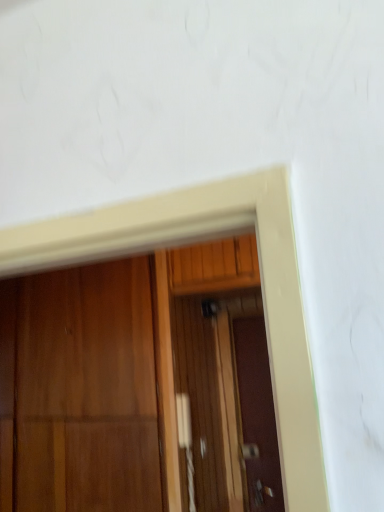
Identify the location of wooden door at center. The width and height of the screenshot is (384, 512). (87, 391).

What do you see at coordinates (87, 391) in the screenshot? I see `wooden door at center` at bounding box center [87, 391].

Locate an element on the screen. The height and width of the screenshot is (512, 384). wooden door at center is located at coordinates (87, 391).